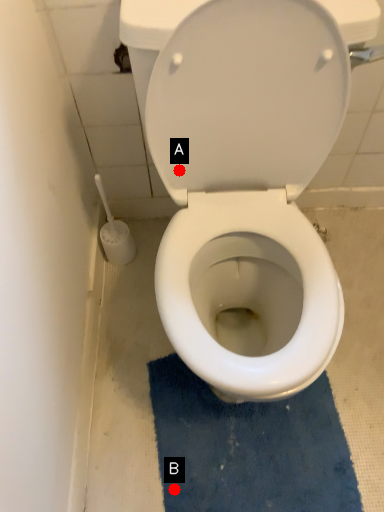
Question: Two points are circled on the image, labeled by A and B beside each circle. Which of the following is the farthest from the observer?

Choices:
 (A) A is further
 (B) B is further

Answer: (B)